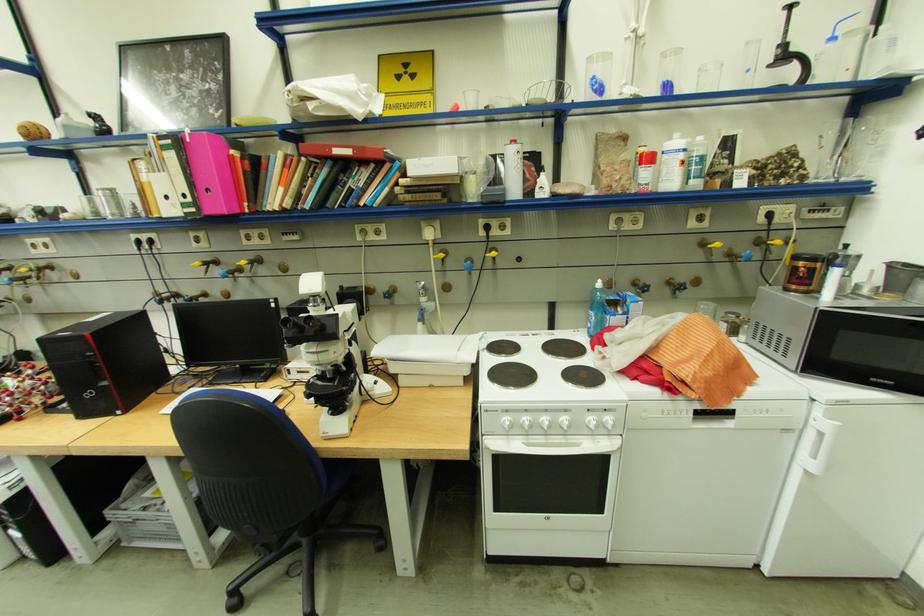
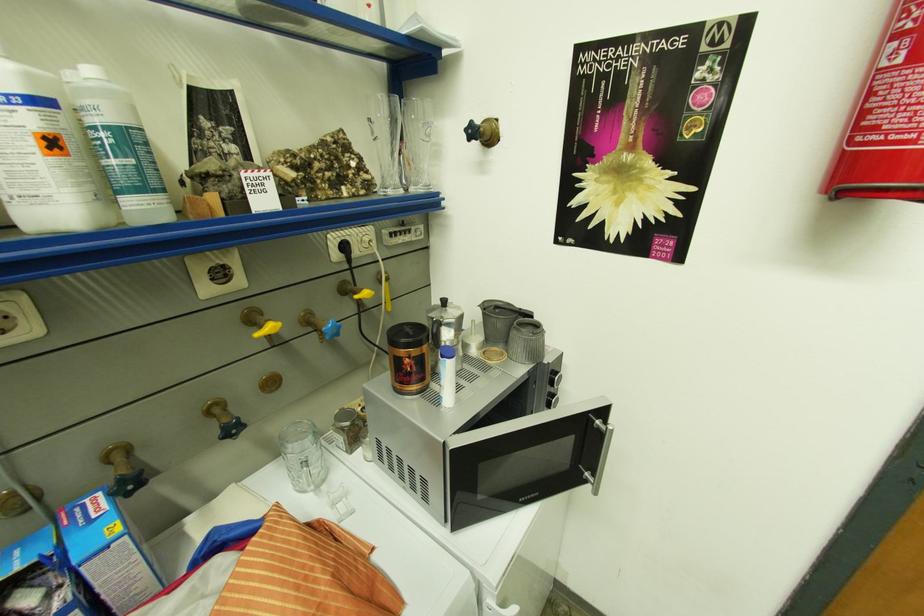
Where in the second image is the point corresponding to (854,180) from the first image?

(422, 191)